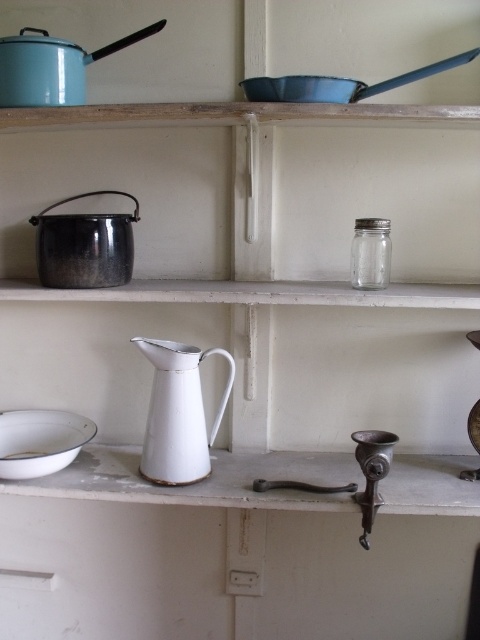
You are organizing the kitchen shelves and need to place a new item between the enamel blue pot at upper left and the white enamel plate at lower left. Based on their widths, which object should be placed on the left to ensure stability?

The enamel blue pot at upper left might be wider than the white enamel plate at lower left, so placing it on the left would provide a stable base for the arrangement.

You are organizing the kitchen shelves and need to move the white enameled pitcher at center. Where is the enamel blue pot at upper left located in relation to it?

The enamel blue pot at upper left is behind the white enameled pitcher at center.